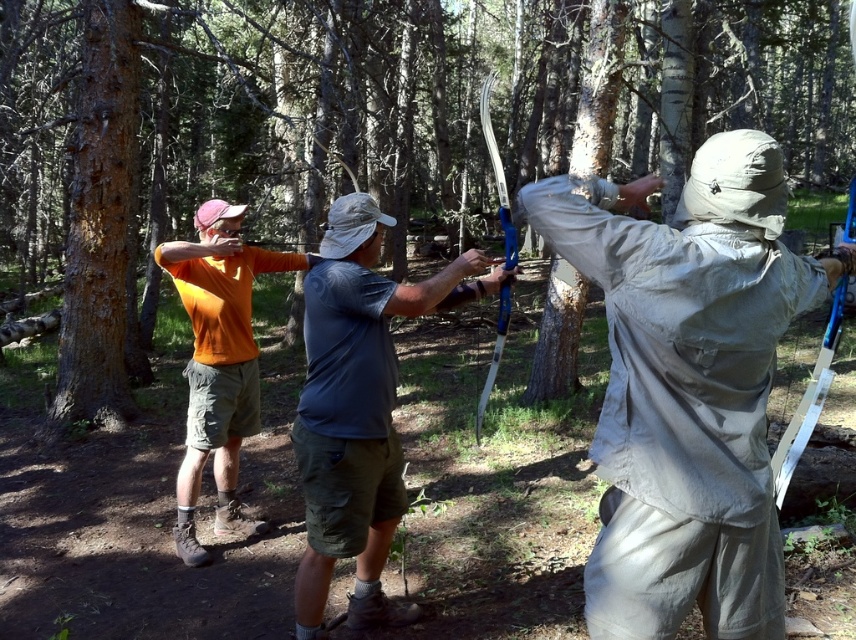
You are an archer standing at the brown rough tree at center and you want to shoot an arrow to the gray fabric shirt at center. The maximum distance your bow can shoot is 40 feet. Can you hit the target?

The brown rough tree at center and gray fabric shirt at center are 38.25 feet apart. Since the distance is less than the maximum range of 40 feet, the arrow can reach the target.

You are an archer aiming to hit a target placed at point A and point B in the forest. The coordinates for point A are point (305, 392) and for point B are point (194, 449). If you want to shoot the closer target first, which point should you aim for?

Point A is closer to the viewer than point B, so you should aim for point A first.

You are an archery instructor observing the group. You need to give instructions to the person wearing the orange cotton shirt at left and the khaki fabric jacket at center. Since you are facing the group, which person is on your left?

The orange cotton shirt at left is on your left because the khaki fabric jacket at center is positioned on the right side of orange cotton shirt at left, meaning from your perspective facing them, the orange cotton shirt at left would be to your left side.